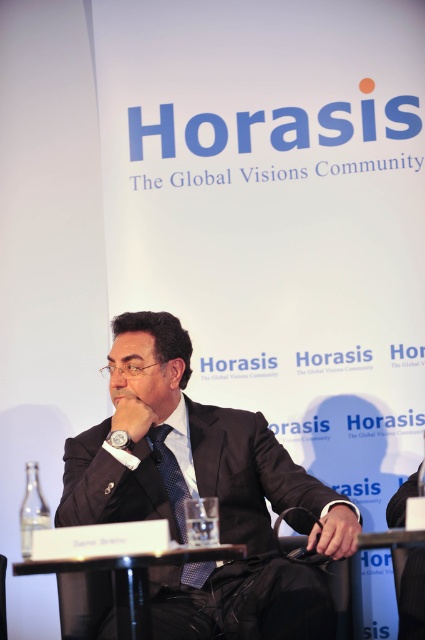
Can you confirm if dark gray suit at center is positioned below black plastic table at lower center?

Actually, dark gray suit at center is above black plastic table at lower center.

Who is positioned more to the right, dark gray suit at center or black plastic table at lower center?

Positioned to the right is dark gray suit at center.

Is point (107, 477) closer to camera compared to point (116, 612)?

No, (107, 477) is further to viewer.

Where is `dark gray suit at center`? dark gray suit at center is located at coordinates (204, 493).

This screenshot has height=640, width=425. Find the location of `black plastic table at lower center`. black plastic table at lower center is located at coordinates (116, 586).

Who is positioned more to the right, black plastic table at lower center or dark blue textured tie at center?

From the viewer's perspective, dark blue textured tie at center appears more on the right side.

Who is more distant from viewer, (121,595) or (178,474)?

The point (178,474) is more distant.

Identify the location of black plastic table at lower center. This screenshot has height=640, width=425. (116, 586).

Who is lower down, dark gray suit at center or dark blue textured tie at center?

dark blue textured tie at center is lower down.

This screenshot has width=425, height=640. Identify the location of dark gray suit at center. (204, 493).

Locate an element on the screen. The width and height of the screenshot is (425, 640). dark gray suit at center is located at coordinates (204, 493).